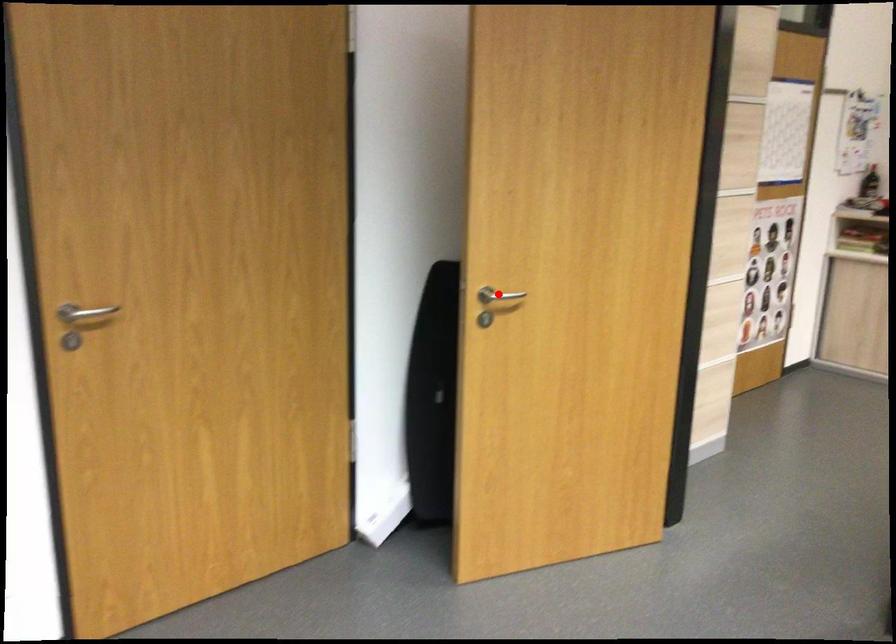
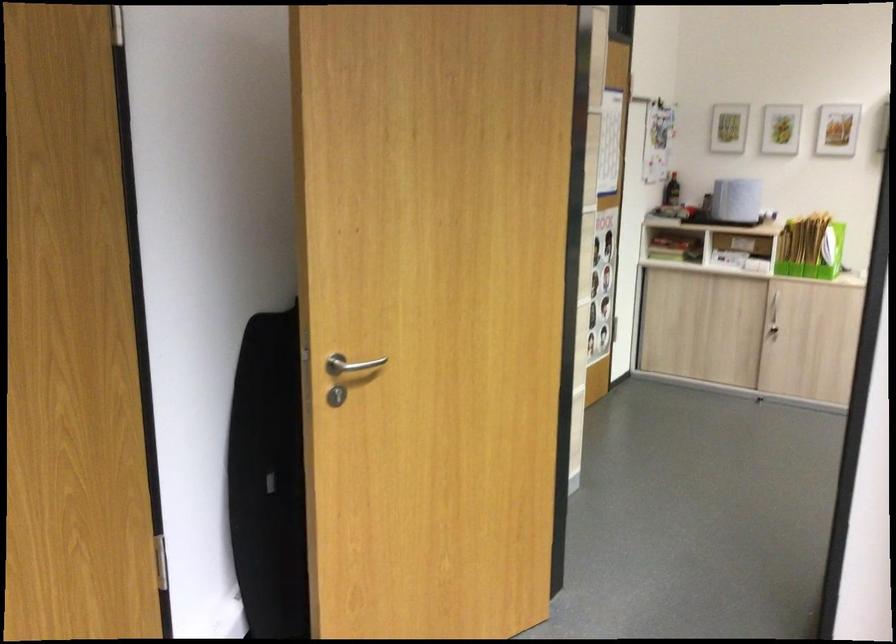
Question: I am providing you with two images of the same scene from different viewpoints. Image1 has a red point marked. In image2, the corresponding 3D location appears at what relative position? Reply with the corresponding letter.

Choices:
 (A) Closer
 (B) Farther

Answer: (A)